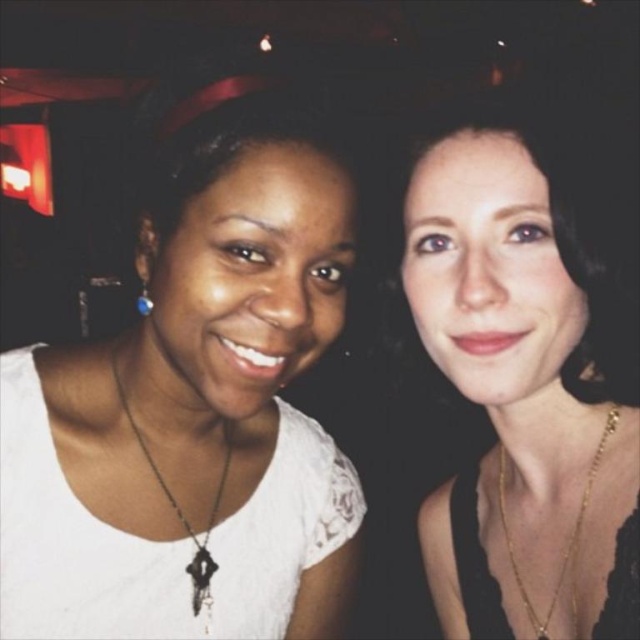
Looking at this image, does matte black hair at upper right have a greater height compared to black matte key pendant at center?

Yes.

Between point (573, 557) and point (211, 518), which one is positioned in front?

Positioned in front is point (573, 557).

What do you see at coordinates (525, 380) in the screenshot? I see `matte black hair at upper right` at bounding box center [525, 380].

Locate an element on the screen. Image resolution: width=640 pixels, height=640 pixels. matte black hair at upper right is located at coordinates (525, 380).

Which of these two, gold chain necklace at right or black matte key pendant at center, stands taller?

With more height is black matte key pendant at center.

Is point (516, 584) positioned after point (200, 608)?

Yes, it is.

This screenshot has width=640, height=640. What do you see at coordinates (568, 540) in the screenshot? I see `gold chain necklace at right` at bounding box center [568, 540].

I want to click on gold chain necklace at right, so click(568, 540).

Can you confirm if matte black hair at upper right is shorter than blue gemstone earring at left?

No, matte black hair at upper right is not shorter than blue gemstone earring at left.

Identify the location of matte black hair at upper right. (525, 380).

I want to click on matte black hair at upper right, so click(x=525, y=380).